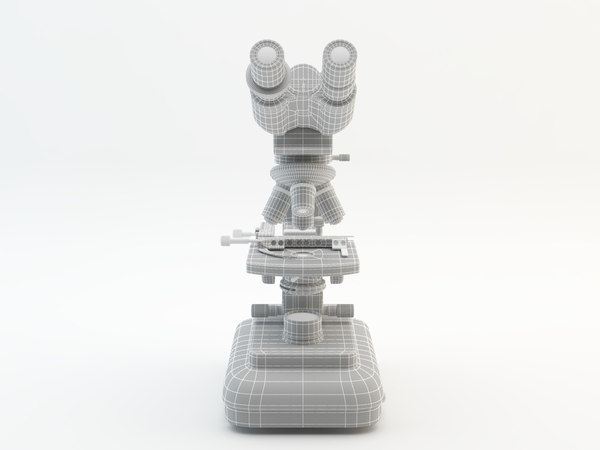
I want to click on adjusting knob, so click(343, 156).